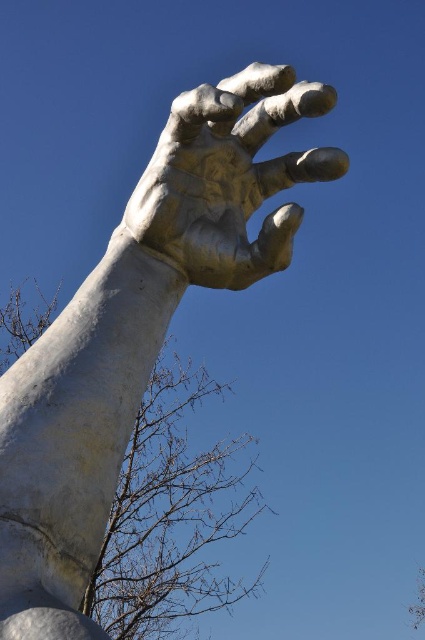
You are an art conservator assessing the sculpture. You notice the white stone hand at upper center and the brown leafless branches at lower left. Which object has a smaller width?

The white stone hand at upper center has a lesser width compared to the brown leafless branches at lower left.

You are standing in front of the sculpture and want to touch the white stone hand at upper center. Based on its position coordinates, where should you aim your hand to reach it?

The white stone hand at upper center is located at coordinates point (138, 330), so you should aim your hand towards the upper center position to reach it.